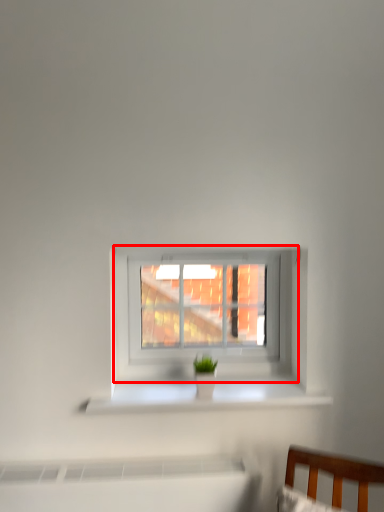
Question: From the image's perspective, where is window (annotated by the red box) located in relation to window sill in the image?

Choices:
 (A) above
 (B) below

Answer: (A)